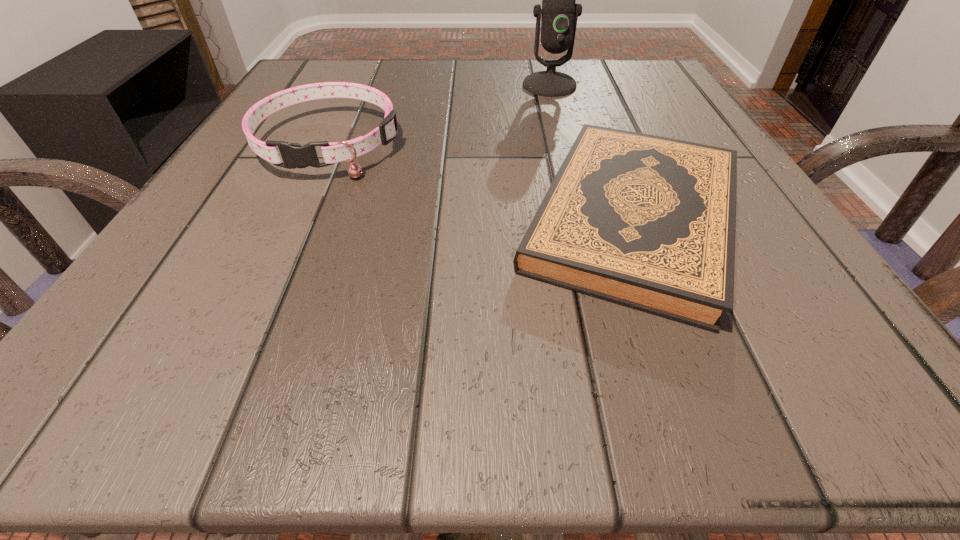
Identify the location of object that is positioned at the left edge. The width and height of the screenshot is (960, 540). (293, 155).

Where is `object located in the right edge section of the desktop`? This screenshot has width=960, height=540. object located in the right edge section of the desktop is located at coordinates (647, 222).

What are the coordinates of `object that is positioned at the near right corner` in the screenshot? It's located at (647, 222).

I want to click on free region at the far edge of the desktop, so click(460, 106).

Identify the location of free space at the near edge of the desktop. This screenshot has width=960, height=540. (499, 340).

This screenshot has height=540, width=960. In order to click on vacant area at the left edge in this screenshot , I will do `click(295, 237)`.

In the image, there is a desktop. In order to click on free region at the right edge in this screenshot , I will do point(685,133).

The height and width of the screenshot is (540, 960). I want to click on free space at the far left corner of the desktop, so click(357, 68).

Find the location of a particular element. This screenshot has height=540, width=960. vacant area at the near left corner of the desktop is located at coordinates (107, 387).

Identify the location of free space at the far right corner of the desktop. (677, 87).